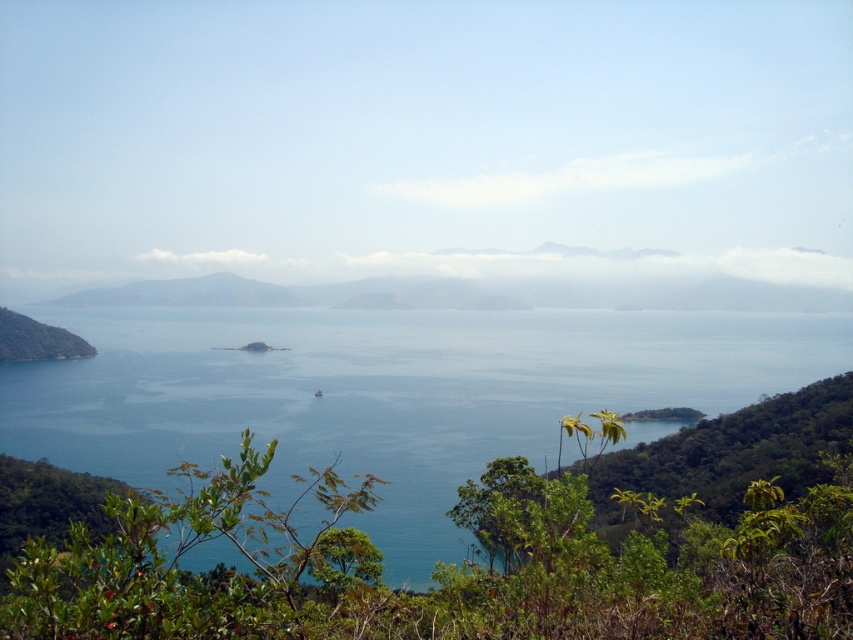
Question: Which object appears closest to the camera in this image?

Choices:
 (A) green leafy hillside at left
 (B) blue water at center

Answer: (B)

Question: Can you confirm if blue water at center is wider than green leafy hillside at left?

Choices:
 (A) no
 (B) yes

Answer: (B)

Question: In this image, where is blue water at center located relative to green leafy hillside at left?

Choices:
 (A) below
 (B) above

Answer: (A)

Question: Which point is farther to the camera?

Choices:
 (A) (498, 353)
 (B) (20, 314)

Answer: (B)

Question: Which object appears farthest from the camera in this image?

Choices:
 (A) blue water at center
 (B) green leafy hillside at left

Answer: (B)

Question: Is blue water at center bigger than green leafy hillside at left?

Choices:
 (A) no
 (B) yes

Answer: (B)